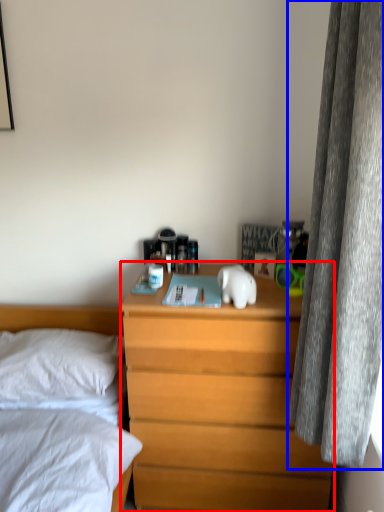
Question: Which object appears farthest to the camera in this image, nightstand (highlighted by a red box) or curtain (highlighted by a blue box)?

Choices:
 (A) nightstand
 (B) curtain

Answer: (A)